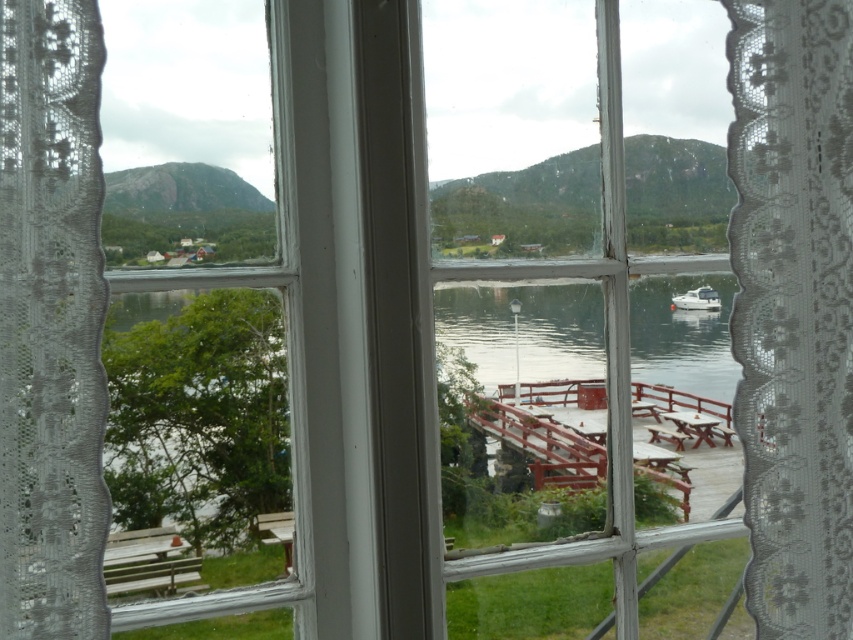
Based on the photo, you are looking through a window and see two white lace curtains. The white lace curtain at center and the white lace curtain at left are both visible. Which curtain is closer to the left side of the window?

The white lace curtain at left is closer to the left side of the window since it is positioned to the left of the white lace curtain at center.